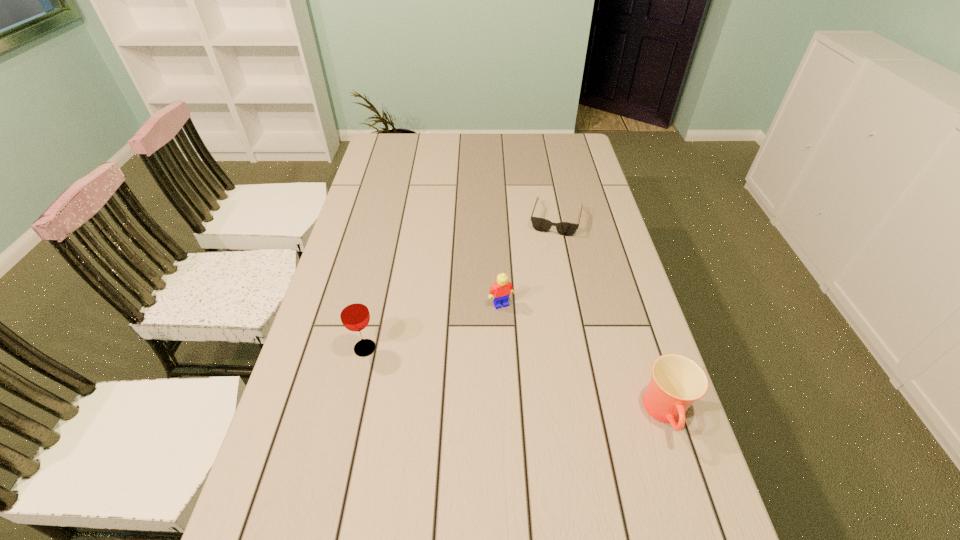
At what (x,y) coordinates should I click in order to perform the action: click on free space on the desktop that is between the leftmost object and the rightmost object and is positioned at the front lenses of the farthest object. Please return your answer as a coordinate pair (x, y). Looking at the image, I should click on (516, 381).

At what (x,y) coordinates should I click in order to perform the action: click on free space on the desktop that is between the glass and the rightmost object and is positioned on the front-facing side of the second farthest object. Please return your answer as a coordinate pair (x, y). This screenshot has height=540, width=960. Looking at the image, I should click on (541, 387).